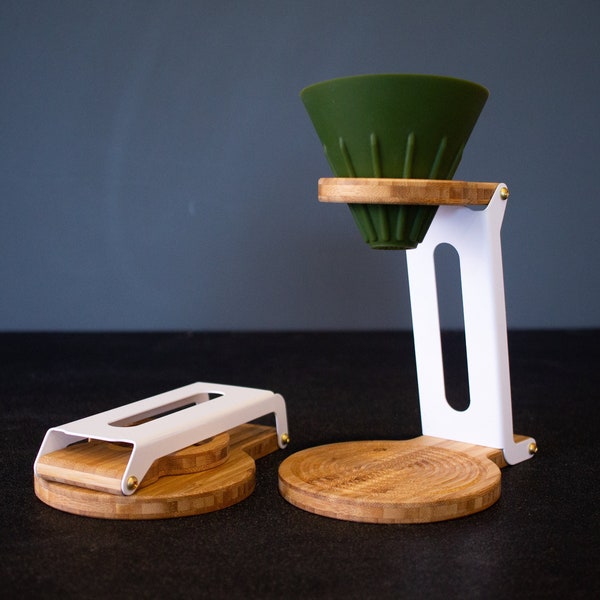
I want to click on wood base, so click(x=212, y=491), click(x=424, y=500).